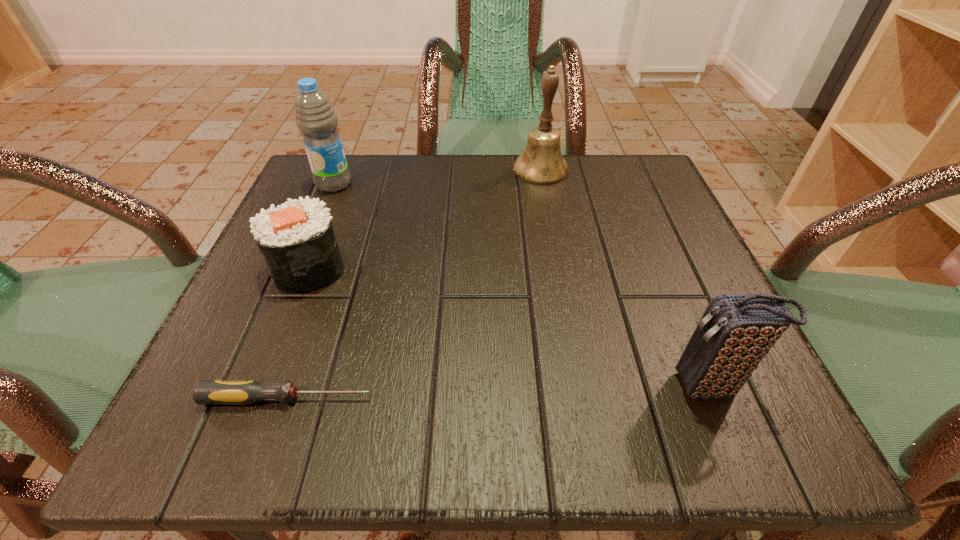
Where is `vacant point located between the water bottle and the bell`? Image resolution: width=960 pixels, height=540 pixels. vacant point located between the water bottle and the bell is located at coordinates (438, 177).

You are a GUI agent. You are given a task and a screenshot of the screen. Output one action in this format:
    pyautogui.click(x=<x>, y=<y>)
    Task: Click on the object that is the nearest to the shortest object
    Image resolution: width=960 pixels, height=540 pixels.
    Given the screenshot: What is the action you would take?
    pyautogui.click(x=296, y=239)

Identify which object is located as the nearest to the clutch bag. Please provide its 2D coordinates. Your answer should be formatted as a tuple, i.e. [(x, y)], where the tuple contains the x and y coordinates of a point satisfying the conditions above.

[(241, 392)]

In order to click on free space that satisfies the following two spatial constraints: 1. on the back side of the bell; 2. on the right side of the second shortest object in this screenshot , I will do `click(348, 170)`.